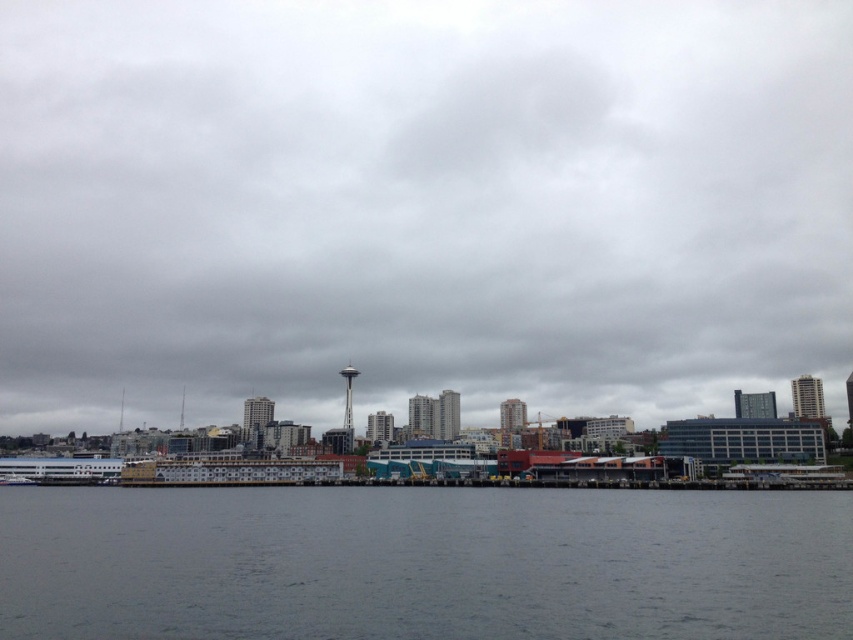
Question: Is gray cloudy sky at center in front of gray water at lower center?

Choices:
 (A) no
 (B) yes

Answer: (A)

Question: Does gray cloudy sky at center come behind gray water at lower center?

Choices:
 (A) yes
 (B) no

Answer: (A)

Question: Does gray cloudy sky at center appear over gray water at lower center?

Choices:
 (A) yes
 (B) no

Answer: (A)

Question: Which object is farther from the camera taking this photo?

Choices:
 (A) gray cloudy sky at center
 (B) gray water at lower center

Answer: (A)

Question: Which object is farther from the camera taking this photo?

Choices:
 (A) gray water at lower center
 (B) gray cloudy sky at center

Answer: (B)